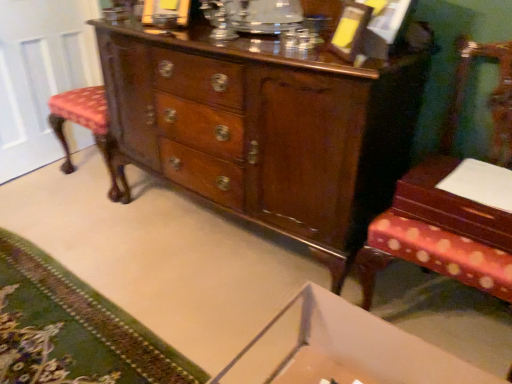
Find the location of a particular element. free space below shiny brown wood chest of drawers at center (from a real-world perspective) is located at coordinates pos(225,237).